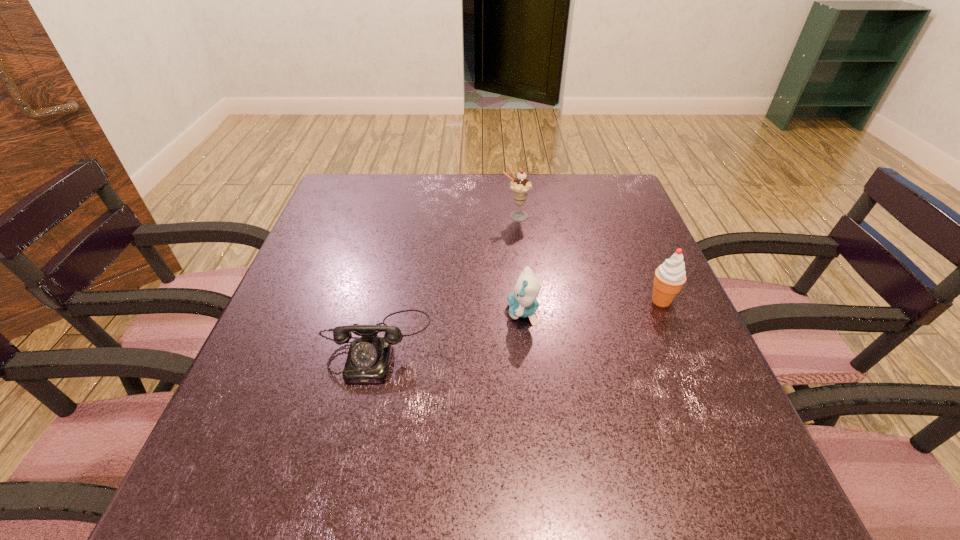
Image resolution: width=960 pixels, height=540 pixels. Find the location of `the farthest object`. the farthest object is located at coordinates (520, 186).

Where is `the left icecream`? the left icecream is located at coordinates (520, 186).

Image resolution: width=960 pixels, height=540 pixels. In order to click on the rightmost object in this screenshot , I will do `click(670, 276)`.

Identify the location of the right icecream. The height and width of the screenshot is (540, 960). tap(670, 276).

Find the location of `the second shortest object`. the second shortest object is located at coordinates (522, 303).

The image size is (960, 540). I want to click on the leftmost object, so click(368, 360).

At what (x,y) coordinates should I click in order to perform the action: click on telephone. Please return your answer as a coordinate pair (x, y). This screenshot has height=540, width=960. Looking at the image, I should click on (368, 360).

Locate an element on the screen. free spot located on the back of the left icecream is located at coordinates pyautogui.click(x=512, y=186).

Locate an element on the screen. vacant space located 0.250m on the back of the rightmost object is located at coordinates (629, 225).

In order to click on vacant region located 0.340m on the face of the kitten in this screenshot , I will do `click(343, 312)`.